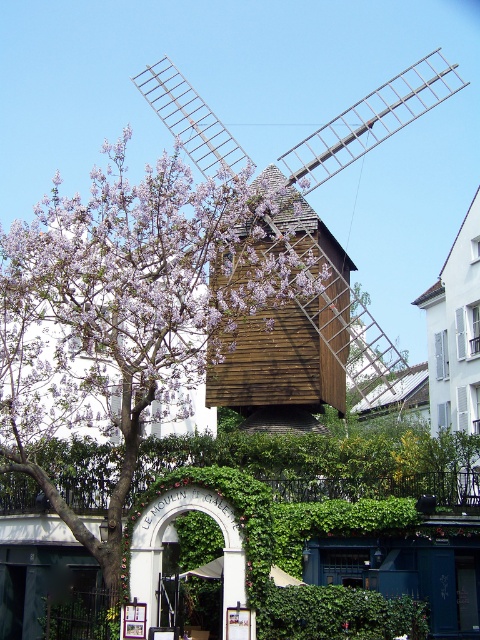
Who is positioned more to the right, purple leafy tree at center or wooden windmill at center?

Positioned to the right is wooden windmill at center.

Between purple leafy tree at center and wooden windmill at center, which one has less height?

purple leafy tree at center

Describe the element at coordinates (127, 310) in the screenshot. The image size is (480, 640). I see `purple leafy tree at center` at that location.

Locate an element on the screen. This screenshot has height=640, width=480. purple leafy tree at center is located at coordinates (127, 310).